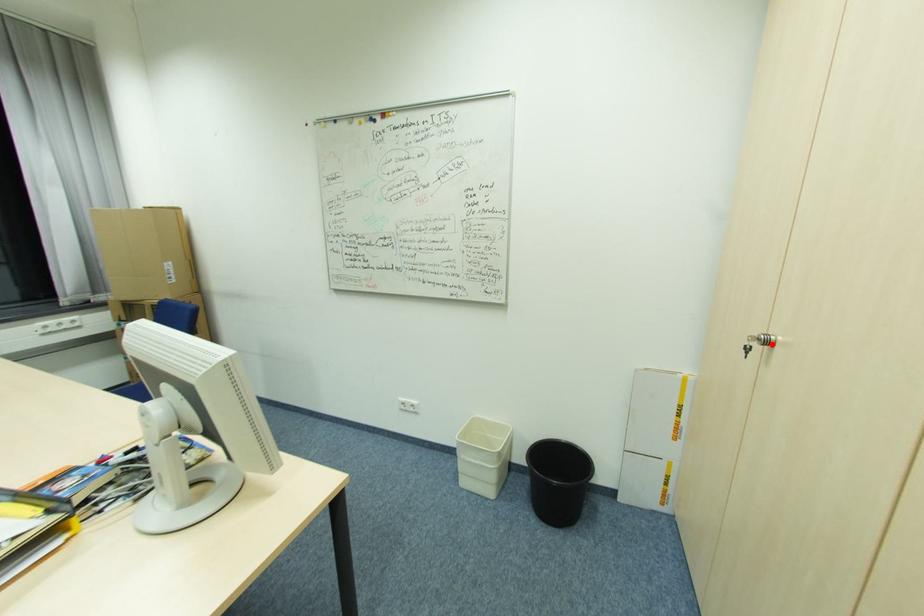
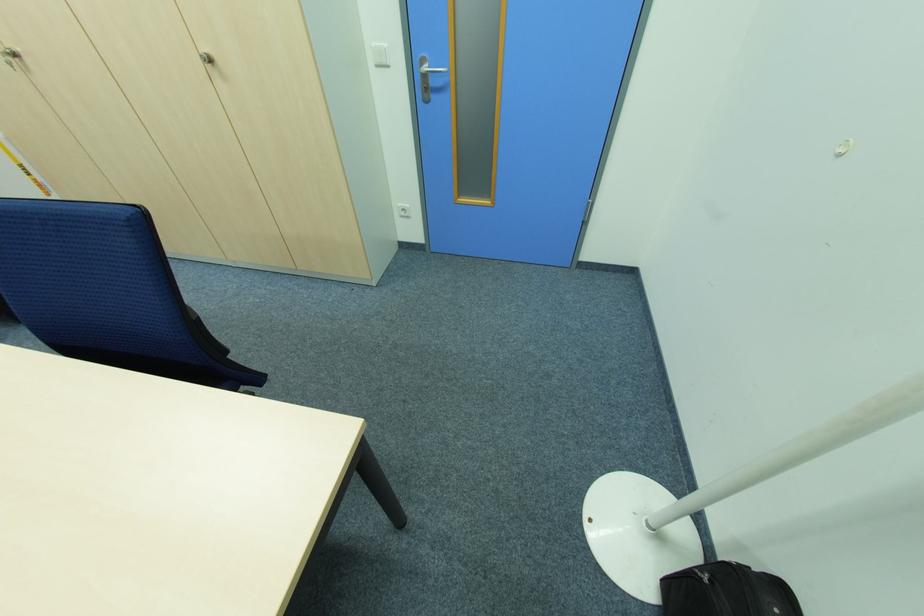
Where in the second image is the point corresponding to the highlighted location from the first image?

(18, 55)